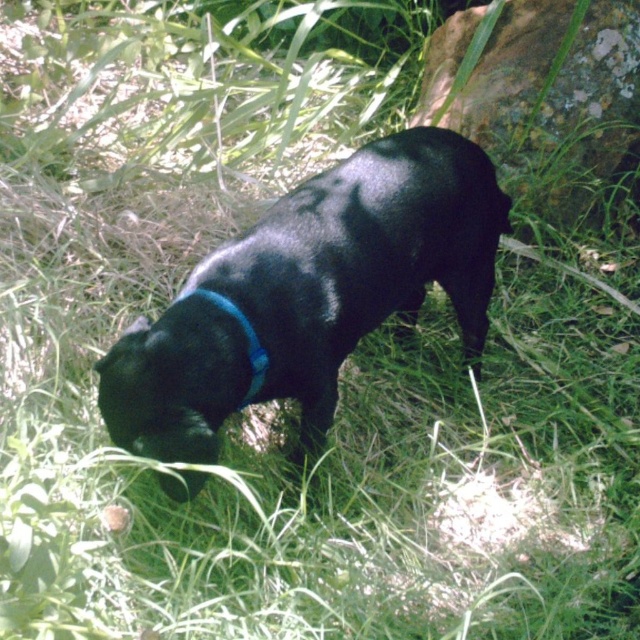
You are a drone operator trying to capture aerial footage of the black dog. The drone has two markers displayed on its screen at coordinates point (416, 164) and point (250, 346). Which marker should you prioritize to ensure the drone stays above the dog without blocking the view of the grass below?

Point (250, 346) should be prioritized because point (416, 164) is behind point (250, 346), so using the front marker will keep the drone above the dog while allowing the grass to be visible below.

You are a photographer trying to capture the shiny black dog at center and the blue fabric neckband at center in a single shot. If you want to ensure both are fully visible without cropping, which object requires more space horizontally in the frame?

The shiny black dog at center requires more space horizontally in the frame because its width surpasses that of the blue fabric neckband at center.